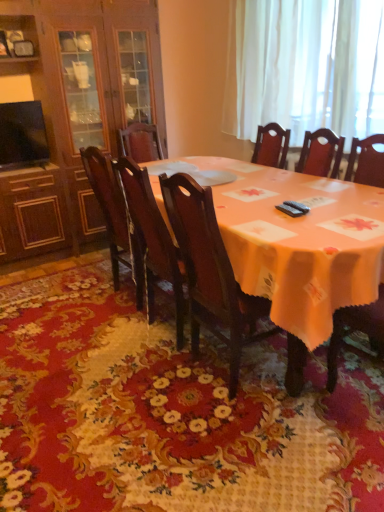
Question: Can we say dark wood chair at center, which is counted as the 2th chair, starting from the right, lies outside matte orange tablecloth at center?

Choices:
 (A) no
 (B) yes

Answer: (A)

Question: Considering the relative sizes of dark wood chair at center, which is counted as the 2th chair, starting from the right, and matte orange tablecloth at center in the image provided, is dark wood chair at center, which is counted as the 2th chair, starting from the right, wider than matte orange tablecloth at center?

Choices:
 (A) no
 (B) yes

Answer: (A)

Question: Can you confirm if dark wood chair at center, which is counted as the 2th chair, starting from the right, is positioned to the left of matte orange tablecloth at center?

Choices:
 (A) yes
 (B) no

Answer: (A)

Question: Can you confirm if dark wood chair at center, which ranks as the 2th chair in left-to-right order, is positioned to the right of matte orange tablecloth at center?

Choices:
 (A) no
 (B) yes

Answer: (A)

Question: Is dark wood chair at center, which ranks as the 2th chair in left-to-right order, far away from matte orange tablecloth at center?

Choices:
 (A) no
 (B) yes

Answer: (A)

Question: Considering the relative sizes of dark wood chair at center, which is counted as the 2th chair, starting from the right, and matte orange tablecloth at center in the image provided, is dark wood chair at center, which is counted as the 2th chair, starting from the right, taller than matte orange tablecloth at center?

Choices:
 (A) no
 (B) yes

Answer: (B)

Question: Considering the relative sizes of dark wood chair at center, which is counted as the first chair, starting from the right, and matte orange tablecloth at center in the image provided, is dark wood chair at center, which is counted as the first chair, starting from the right, bigger than matte orange tablecloth at center?

Choices:
 (A) no
 (B) yes

Answer: (A)

Question: Considering the relative sizes of dark wood chair at center, which is counted as the first chair, starting from the right, and matte orange tablecloth at center in the image provided, is dark wood chair at center, which is counted as the first chair, starting from the right, taller than matte orange tablecloth at center?

Choices:
 (A) yes
 (B) no

Answer: (A)

Question: Does dark wood chair at center, which is counted as the first chair, starting from the right, have a lesser height compared to matte orange tablecloth at center?

Choices:
 (A) yes
 (B) no

Answer: (B)

Question: From a real-world perspective, is dark wood chair at center, which is counted as the first chair, starting from the right, over matte orange tablecloth at center?

Choices:
 (A) yes
 (B) no

Answer: (A)

Question: Is dark wood chair at center, the 3th chair viewed from the left, not within matte orange tablecloth at center?

Choices:
 (A) yes
 (B) no

Answer: (B)

Question: Is dark wood chair at center, the 3th chair viewed from the left, far from matte orange tablecloth at center?

Choices:
 (A) yes
 (B) no

Answer: (B)

Question: From the image's perspective, is polished dark wood chair at center, marked as the 1th chair in a left-to-right arrangement, on floral carpet at center?

Choices:
 (A) yes
 (B) no

Answer: (A)